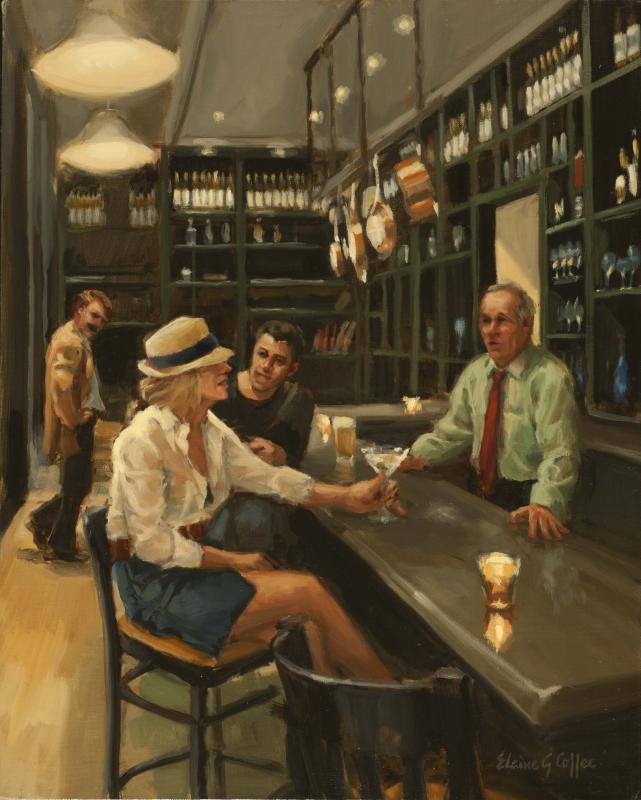
The height and width of the screenshot is (800, 641). In order to click on wine bottles in this screenshot , I will do `click(568, 78)`, `click(281, 188)`, `click(199, 192)`, `click(459, 134)`.